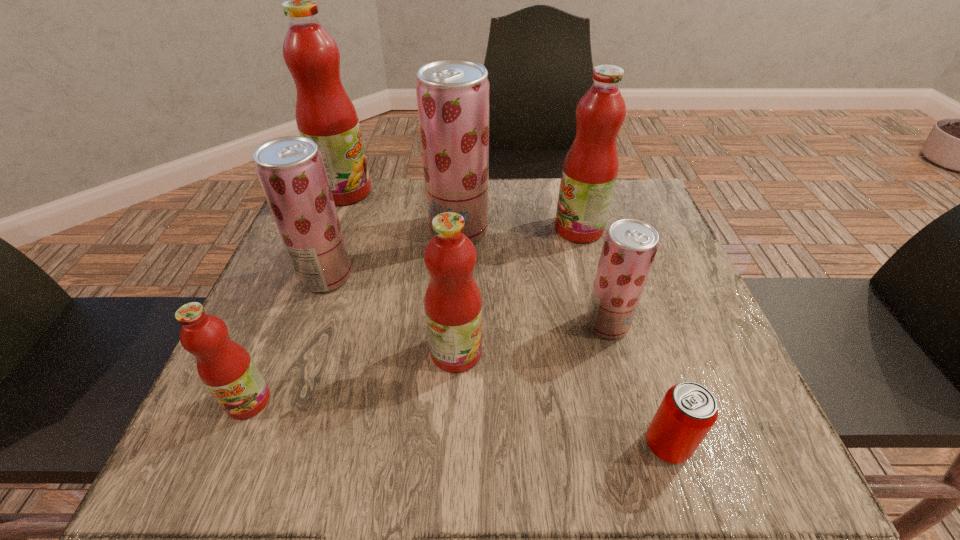
Find the location of a particular element. The image size is (960, 540). the rightmost strawberry fruit juice is located at coordinates [x=630, y=245].

Where is `the smallest strawberry fruit juice`? the smallest strawberry fruit juice is located at coordinates pos(630,245).

The height and width of the screenshot is (540, 960). I want to click on the nearest fruit juice, so 225,367.

Identify the location of the nearest pink fruit juice. 225,367.

Identify the location of the nearest object. The image size is (960, 540). (688, 411).

In order to click on can in this screenshot , I will do `click(688, 411)`.

This screenshot has width=960, height=540. Identify the location of vacant area situated on the front label of the tallest fruit juice. click(x=475, y=192).

Image resolution: width=960 pixels, height=540 pixels. Identify the location of blank space located 0.170m on the front label of the third nearest pink fruit juice. (485, 229).

I want to click on vacant space positioned 0.170m on the front label of the third nearest pink fruit juice, so click(x=485, y=229).

At what (x,y) coordinates should I click in order to perform the action: click on vacant area situated on the front label of the third nearest pink fruit juice. Please return your answer as a coordinate pair (x, y). Looking at the image, I should click on (492, 229).